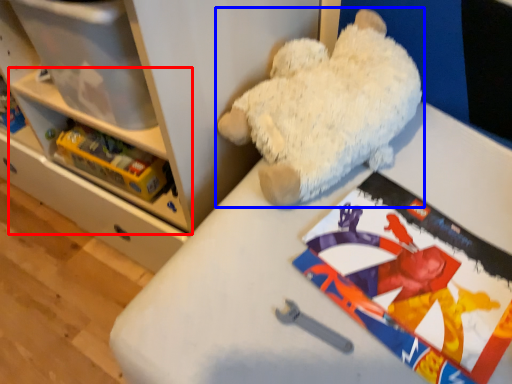
Question: Which of the following is the closest to the observer, shelf (highlighted by a red box) or teddy bear (highlighted by a blue box)?

Choices:
 (A) shelf
 (B) teddy bear

Answer: (B)